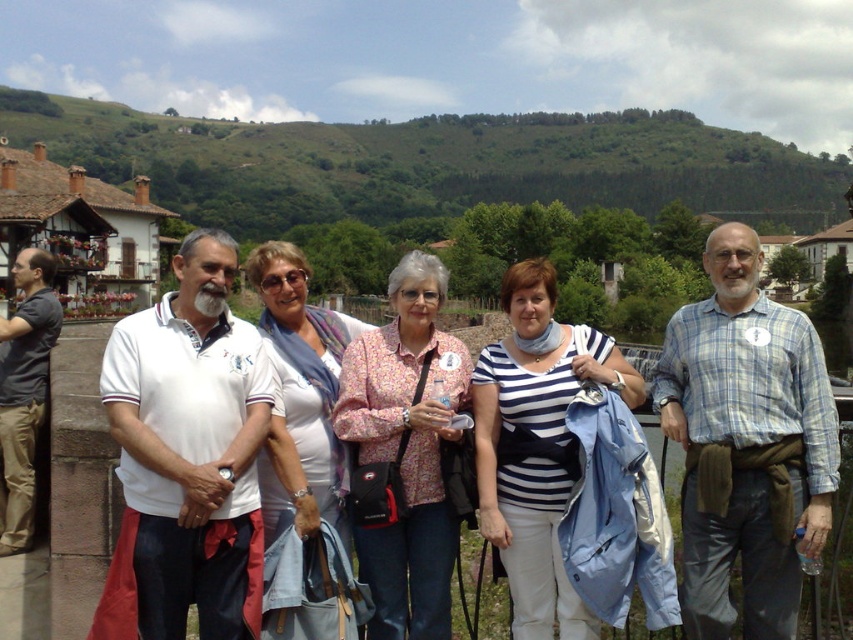
You are a photographer trying to capture a detailed shot of the floral print blouse at center and the white fabric scarf at center. Which of these two items should you zoom in on more to ensure it fits entirely within your camera frame?

The floral print blouse at center occupies less space than the white fabric scarf at center, so you should zoom in more on the white fabric scarf at center to ensure it fits entirely within your camera frame.

You are a photographer trying to capture a group photo of the floral print blouse at center and the white fabric scarf at center. The camera you are using has a minimum focus distance of 5 feet. Will you be able to focus on both subjects simultaneously?

The floral print blouse at center and white fabric scarf at center are 5.27 feet apart from each other. Since the minimum focus distance is 5 feet, the camera can focus on both subjects as the distance between them is greater than the required minimum focus distance.